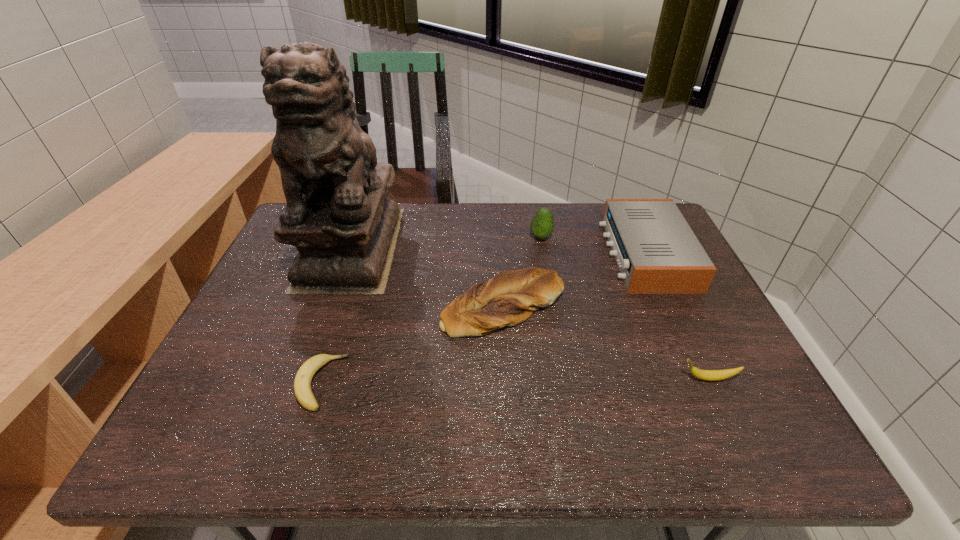
You are a GUI agent. You are given a task and a screenshot of the screen. Output one action in this format:
    pyautogui.click(x=<x>, y=<y>)
    Task: Click on the blank area in the image that satisfies the following two spatial constraints: 1. on the front-facing side of the tallest object; 2. on the left side of the left banana
    The image size is (960, 540).
    Given the screenshot: What is the action you would take?
    pyautogui.click(x=302, y=383)